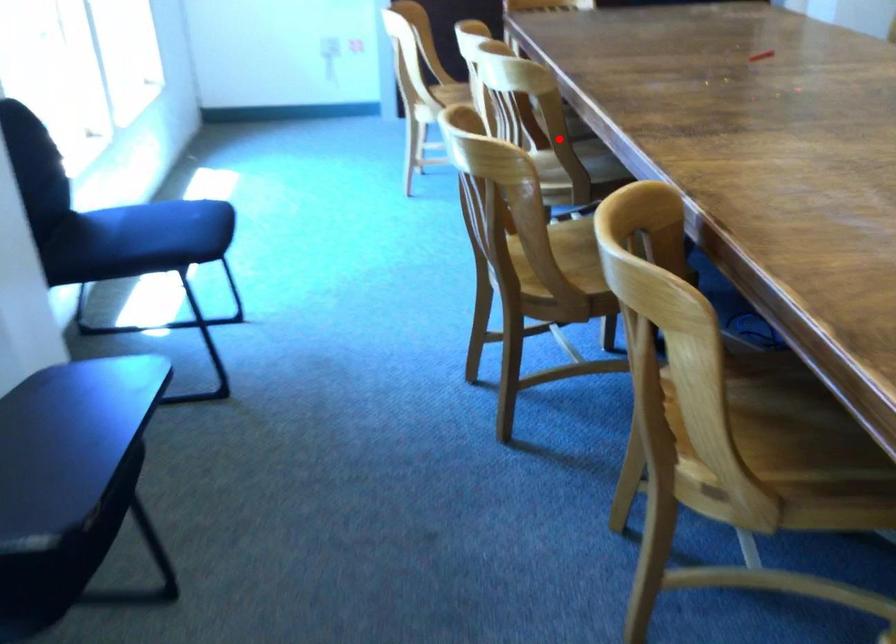
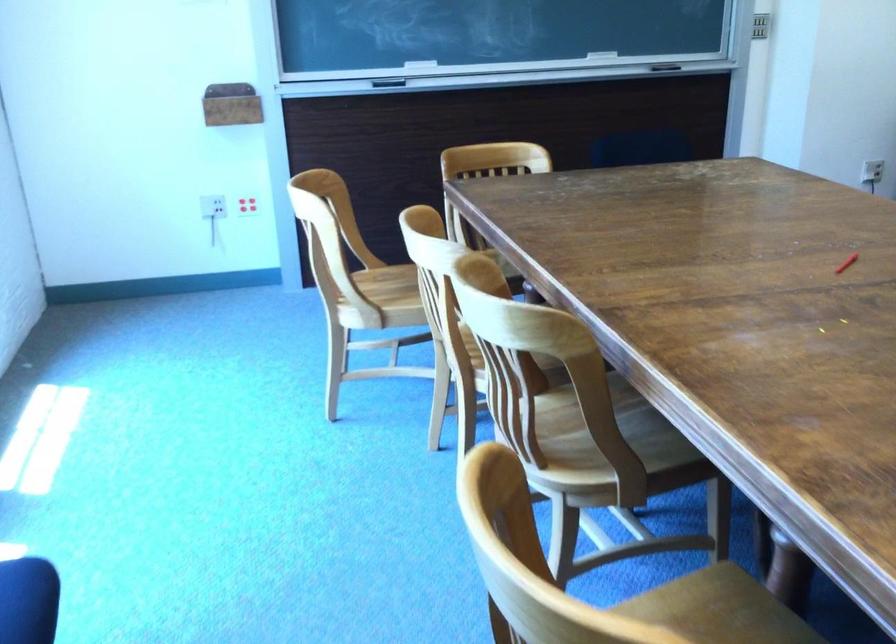
Question: I am providing you with two images of the same scene from different viewpoints. A red point is marked on the first image. Is the red point's position out of view in image 2?

Choices:
 (A) Yes
 (B) No

Answer: (B)